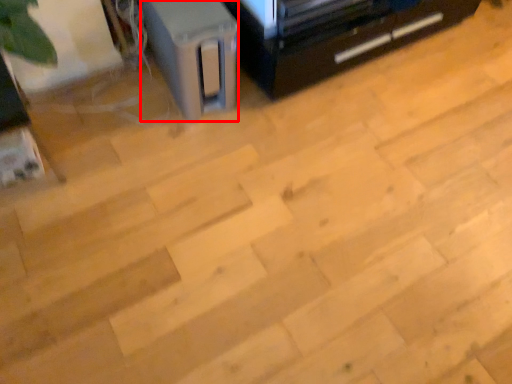
Question: Where is appliance (annotated by the red box) located in relation to furniture in the image?

Choices:
 (A) left
 (B) right

Answer: (A)